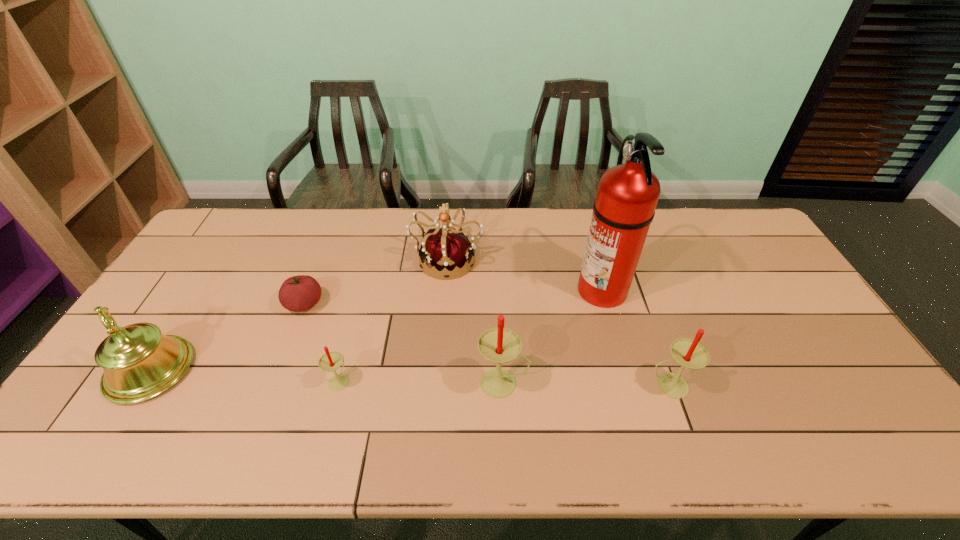
You are a GUI agent. You are given a task and a screenshot of the screen. Output one action in this format:
    pyautogui.click(x=<x>, y=<y>)
    Task: Click on the fifth object from right to left
    The height and width of the screenshot is (540, 960).
    Given the screenshot: What is the action you would take?
    pyautogui.click(x=331, y=361)

Image resolution: width=960 pixels, height=540 pixels. I want to click on the shortest candle, so click(x=331, y=361).

You are a GUI agent. You are given a task and a screenshot of the screen. Output one action in this format:
    pyautogui.click(x=<x>, y=<y>)
    Task: Click on the second candle from left to right
    The height and width of the screenshot is (540, 960).
    Given the screenshot: What is the action you would take?
    pyautogui.click(x=499, y=345)

Locate an element on the screen. The image size is (960, 540). the second shortest candle is located at coordinates (689, 353).

Locate an element on the screen. tiara is located at coordinates (448, 251).

At what (x,y) coordinates should I click in order to perform the action: click on the sixth object from right to left. Please return your answer as a coordinate pair (x, y). The width and height of the screenshot is (960, 540). Looking at the image, I should click on (299, 293).

Identify the location of tomato. The image size is (960, 540). 299,293.

Where is `fire extinguisher`? The width and height of the screenshot is (960, 540). fire extinguisher is located at coordinates pos(627,195).

The height and width of the screenshot is (540, 960). Find the location of `bell`. bell is located at coordinates (139, 362).

Locate an element on the screen. This screenshot has height=540, width=960. vacant region located 0.110m on the left of the leftmost candle is located at coordinates (285, 380).